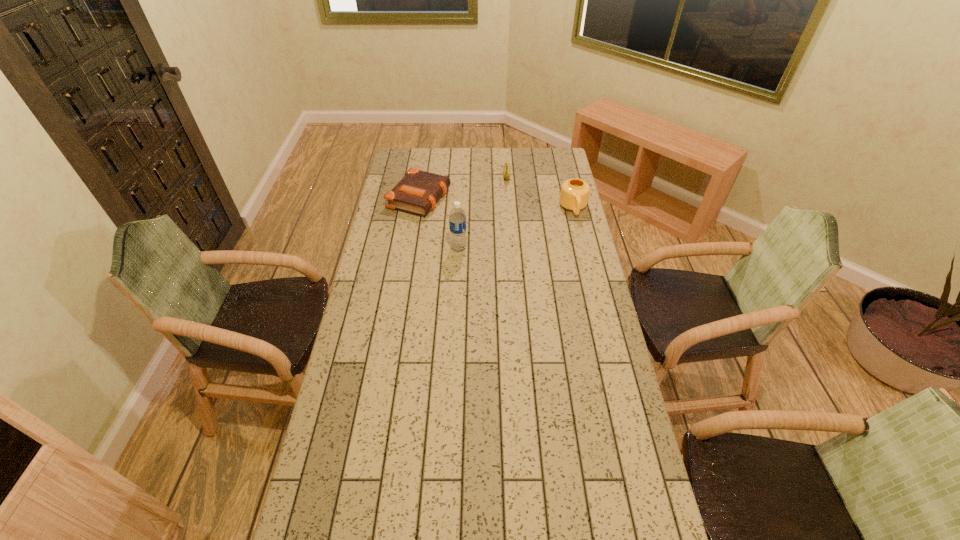
Where is `water bottle`? The image size is (960, 540). water bottle is located at coordinates (457, 218).

Identify the location of the tallest object. (457, 218).

In order to click on the second tallest object in this screenshot , I will do `click(574, 194)`.

Find the location of a particular element. The width and height of the screenshot is (960, 540). the rightmost object is located at coordinates (574, 194).

At what (x,y) coordinates should I click in order to perform the action: click on the shortest object. Please return your answer as a coordinate pair (x, y). The width and height of the screenshot is (960, 540). Looking at the image, I should click on (418, 191).

Where is `Bible`? Bible is located at coordinates (418, 191).

Where is `the second shortest object`? the second shortest object is located at coordinates (507, 165).

Image resolution: width=960 pixels, height=540 pixels. Find the location of `the second object from right to left`. the second object from right to left is located at coordinates (507, 165).

Identify the location of vacant space located 0.250m on the right of the nearest object. (526, 248).

This screenshot has width=960, height=540. Identify the location of vacant region located 0.300m on the handle side of the mug. (588, 267).